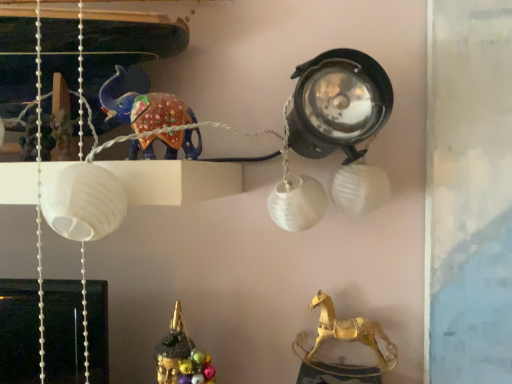
Question: From a real-world perspective, is shiny blue elephant at upper left, the first animal from the left, positioned above or below gold metallic horse at lower right, which is counted as the 2th animal, starting from the top?

Choices:
 (A) below
 (B) above

Answer: (B)

Question: Considering their positions, is shiny blue elephant at upper left, arranged as the 2th animal when viewed from the right, located in front of or behind gold metallic horse at lower right, which appears as the 2th animal when viewed from the left?

Choices:
 (A) front
 (B) behind

Answer: (A)

Question: From the image's perspective, relative to gold metallic horse at lower right, the first animal positioned from the back, is shiny blue elephant at upper left, marked as the 1th animal in a top-to-bottom arrangement, above or below?

Choices:
 (A) above
 (B) below

Answer: (A)

Question: Based on their sizes in the image, would you say gold metallic horse at lower right, the first animal positioned from the back, is bigger or smaller than shiny blue elephant at upper left, which appears as the 1th animal when viewed from the front?

Choices:
 (A) big
 (B) small

Answer: (B)

Question: Is point (366, 329) closer or farther from the camera than point (167, 125)?

Choices:
 (A) closer
 (B) farther

Answer: (B)

Question: In terms of width, does gold metallic horse at lower right, the first animal positioned from the back, look wider or thinner when compared to shiny blue elephant at upper left, arranged as the 2th animal when viewed from the right?

Choices:
 (A) thin
 (B) wide

Answer: (A)

Question: Would you say gold metallic horse at lower right, which appears as the 2th animal when viewed from the left, is inside or outside shiny blue elephant at upper left, marked as the 1th animal in a top-to-bottom arrangement?

Choices:
 (A) inside
 (B) outside

Answer: (B)